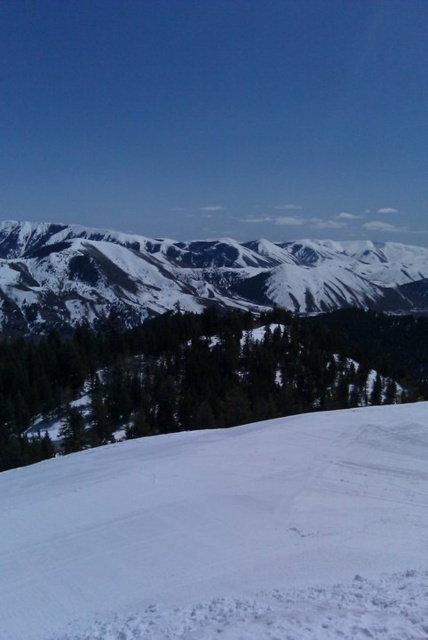
Is white snow ski slope at lower center to the right of white snow-covered mountain at upper center from the viewer's perspective?

No, white snow ski slope at lower center is not to the right of white snow-covered mountain at upper center.

Who is more forward, (225,472) or (163,275)?

Point (225,472) is more forward.

The height and width of the screenshot is (640, 428). What are the coordinates of `white snow ski slope at lower center` in the screenshot? It's located at (225, 532).